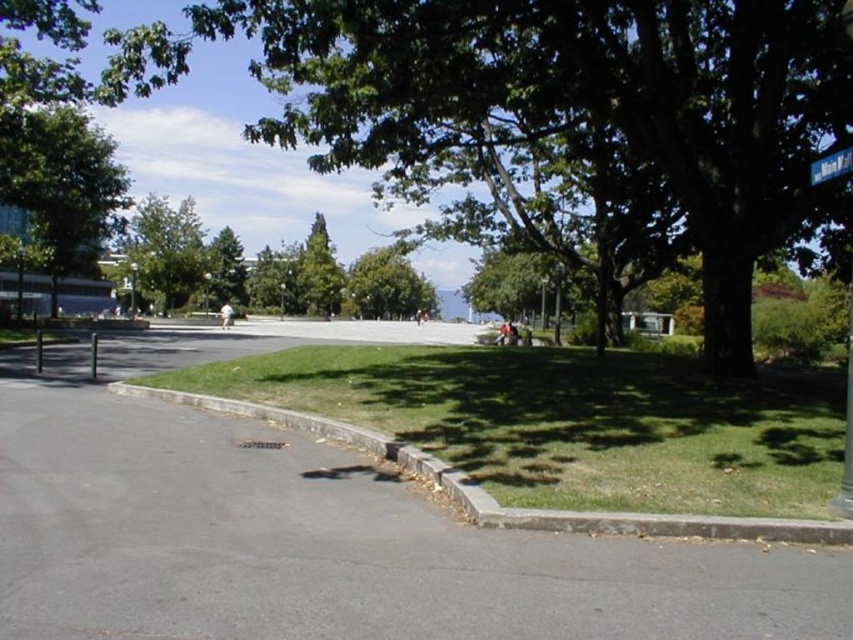
Question: Which is nearer to the green leafy tree at upper left?

Choices:
 (A) metallic pole at left
 (B) green grass at lower center
 (C) metallic pole at center

Answer: (C)

Question: Is green leafy tree at center wider than metallic pole at center?

Choices:
 (A) yes
 (B) no

Answer: (A)

Question: Considering the real-world distances, which object is farthest from the metallic pole at left?

Choices:
 (A) green leafy tree at upper left
 (B) metallic pole at center

Answer: (A)

Question: Considering the relative positions of green grass at lower center and blue plastic street sign at upper right in the image provided, where is green grass at lower center located with respect to blue plastic street sign at upper right?

Choices:
 (A) right
 (B) left

Answer: (B)

Question: Does green leafy tree at upper left have a greater width compared to blue plastic street sign at upper right?

Choices:
 (A) yes
 (B) no

Answer: (A)

Question: Based on their relative distances, which object is nearer to the green leafy tree at upper left?

Choices:
 (A) blue plastic street sign at upper right
 (B) metallic pole at center
 (C) green grass at lower center

Answer: (B)